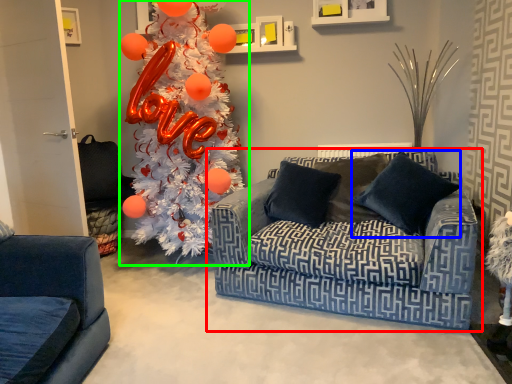
Question: Estimate the real-world distances between objects in this image. Which object is farther from studio couch (highlighted by a red box), pillow (highlighted by a blue box) or christmas tree (highlighted by a green box)?

Choices:
 (A) pillow
 (B) christmas tree

Answer: (B)